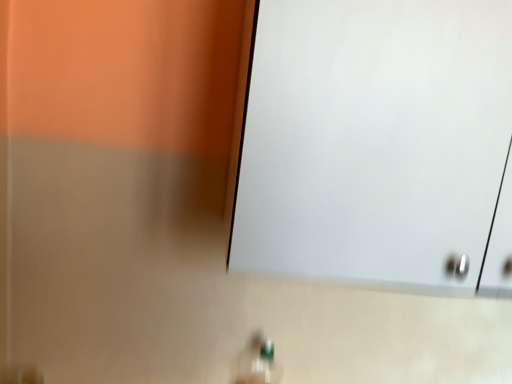
Where is `white glossy screen door at upper center`? The width and height of the screenshot is (512, 384). white glossy screen door at upper center is located at coordinates (378, 145).

The height and width of the screenshot is (384, 512). What do you see at coordinates (378, 145) in the screenshot?
I see `white glossy screen door at upper center` at bounding box center [378, 145].

Where is `white glossy screen door at upper center`? white glossy screen door at upper center is located at coordinates (378, 145).